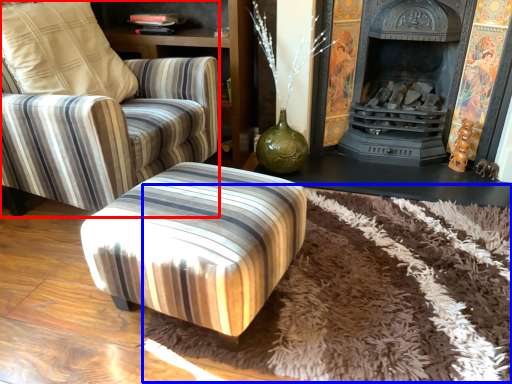
Question: Which object is further to the camera taking this photo, chair (highlighted by a red box) or mat (highlighted by a blue box)?

Choices:
 (A) chair
 (B) mat

Answer: (A)